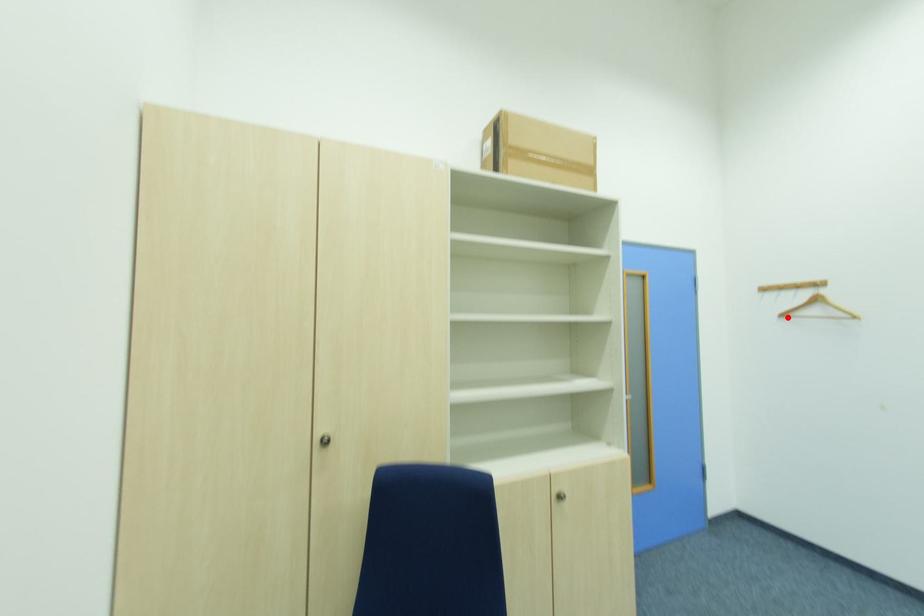
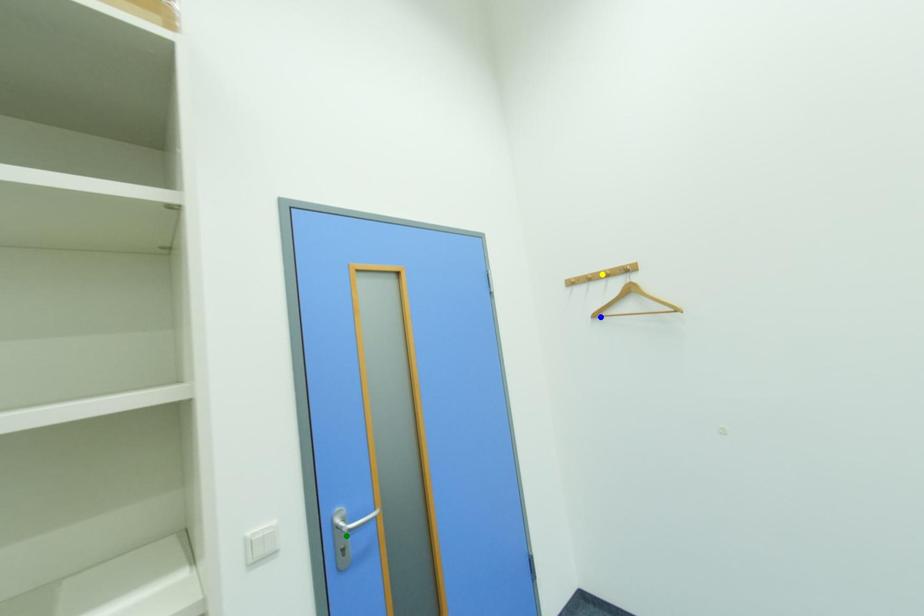
Question: I am providing you with two images of the same scene from different viewpoints. A red point is marked on the first image. You are given multiple points on the second image. Which point in image 2 is actually the same real-world point as the red point in image 1?

Choices:
 (A) green point
 (B) blue point
 (C) yellow point

Answer: (B)